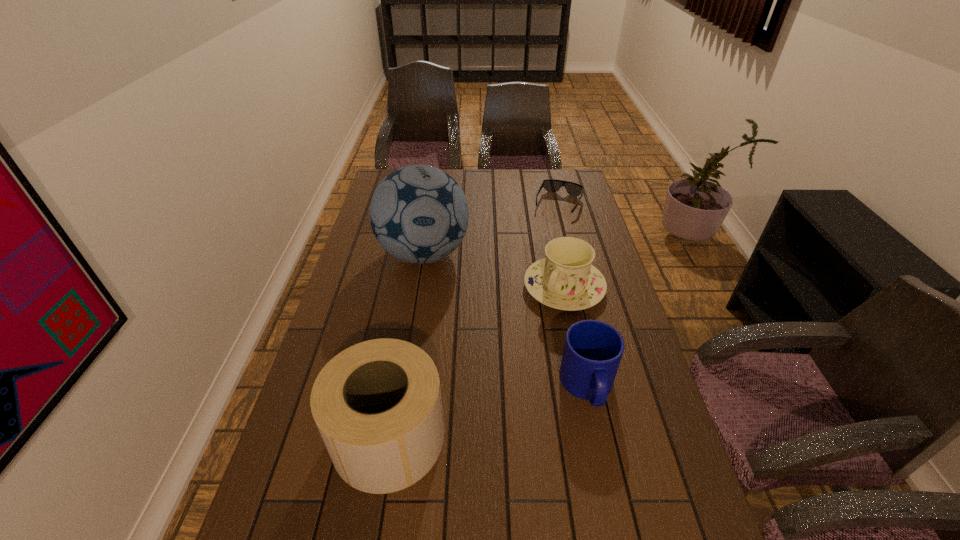
Image resolution: width=960 pixels, height=540 pixels. Identify the location of the fourth shortest object. tap(377, 404).

Where is `mug`? Image resolution: width=960 pixels, height=540 pixels. mug is located at coordinates (592, 352).

Find the location of a particular element. sunglasses is located at coordinates (551, 185).

Identify the location of the shortest object. The width and height of the screenshot is (960, 540). (551, 185).

Where is `chinaware`? chinaware is located at coordinates pyautogui.click(x=565, y=280).

The image size is (960, 540). I want to click on the tallest object, so click(x=419, y=214).

Locate an element on the screen. This screenshot has width=960, height=540. vacant space situated 0.090m on the left of the second tallest object is located at coordinates (295, 437).

This screenshot has width=960, height=540. I want to click on vacant space located 0.120m on the side with the handle of the mug, so click(606, 469).

The height and width of the screenshot is (540, 960). I want to click on vacant area situated on the front-facing side of the sunglasses, so click(x=535, y=263).

Locate an element on the screen. This screenshot has width=960, height=540. vacant space situated on the front-facing side of the sunglasses is located at coordinates (534, 265).